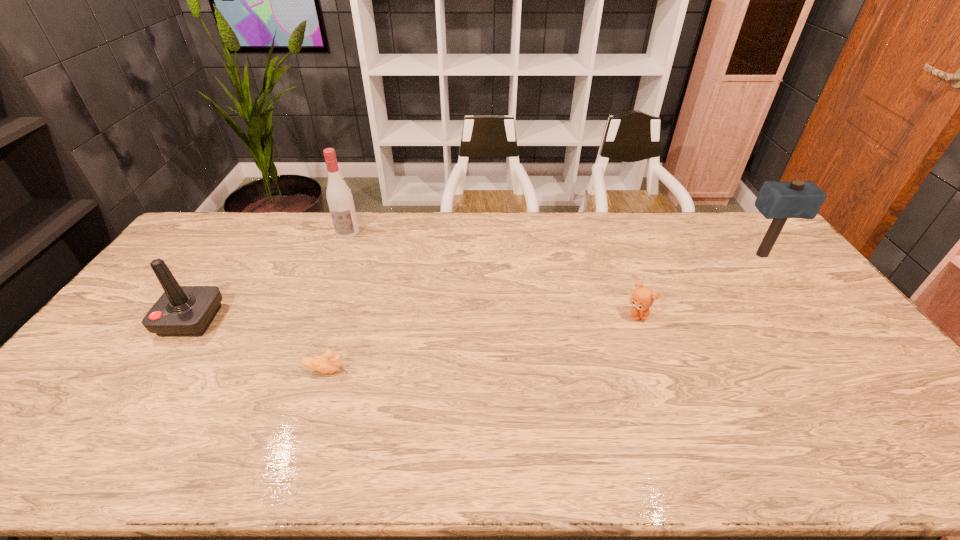
Image resolution: width=960 pixels, height=540 pixels. Find the location of `free space located on the back of the fourth nearest object`. free space located on the back of the fourth nearest object is located at coordinates (731, 217).

The width and height of the screenshot is (960, 540). I want to click on vacant space situated 0.190m on the back of the third tallest object, so click(x=229, y=262).

Locate an element on the screen. The height and width of the screenshot is (540, 960). blank space located on the face of the fourth tallest object is located at coordinates (645, 335).

The height and width of the screenshot is (540, 960). In order to click on vacant space located on the face of the nearest object in this screenshot , I will do `click(468, 370)`.

Where is `alcohol that is at the far edge`? This screenshot has width=960, height=540. alcohol that is at the far edge is located at coordinates (339, 197).

The height and width of the screenshot is (540, 960). I want to click on mallet that is at the far edge, so click(x=779, y=201).

What are the coordinates of `object located in the left edge section of the desktop` in the screenshot? It's located at (182, 311).

You are a GUI agent. You are given a task and a screenshot of the screen. Output one action in this format:
    pyautogui.click(x=<x>, y=<y>)
    Task: Click on the object located in the right edge section of the desktop
    The height and width of the screenshot is (540, 960).
    Given the screenshot: What is the action you would take?
    pyautogui.click(x=779, y=201)

The image size is (960, 540). I want to click on object present at the far right corner, so click(779, 201).

This screenshot has height=540, width=960. Find the location of `vacant space at the far edge`. vacant space at the far edge is located at coordinates (459, 229).